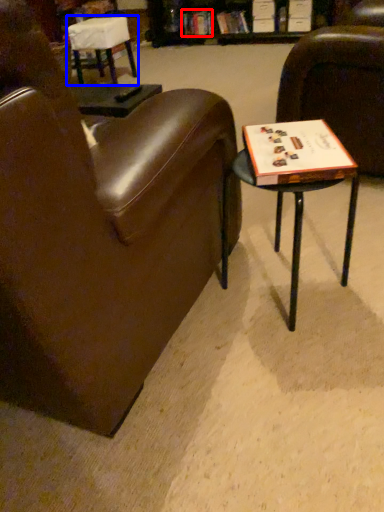
Question: Which object appears closest to the camera in this image, book (highlighted by a red box) or chair (highlighted by a blue box)?

Choices:
 (A) book
 (B) chair

Answer: (B)